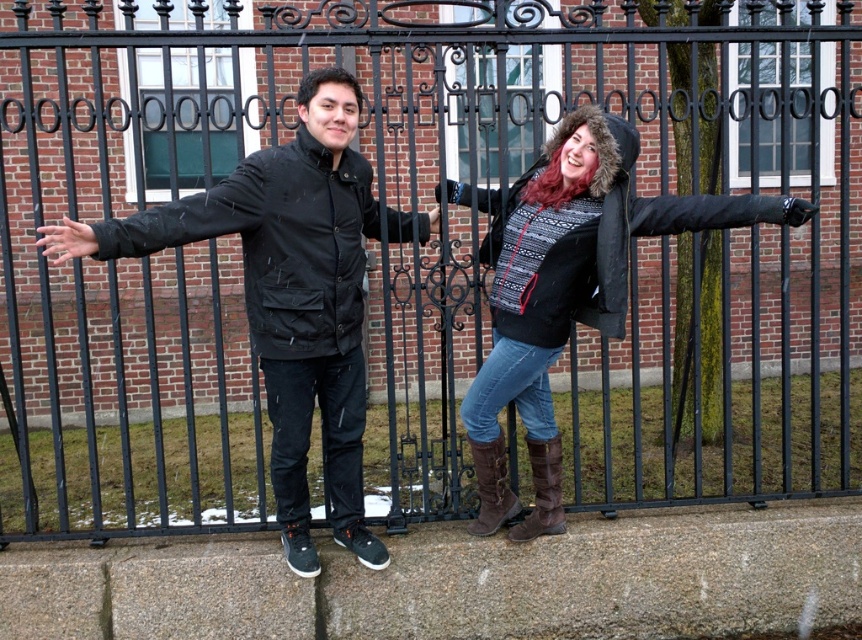
Is matte black jacket at left to the left of brown leather boot at lower center from the viewer's perspective?

Correct, you'll find matte black jacket at left to the left of brown leather boot at lower center.

Identify the location of matte black jacket at left. The width and height of the screenshot is (862, 640). (286, 296).

Locate an element on the screen. This screenshot has height=640, width=862. matte black jacket at left is located at coordinates (286, 296).

From the picture: Is matte black jacket at left wider than knit sweater at center?

No.

What do you see at coordinates (286, 296) in the screenshot? I see `matte black jacket at left` at bounding box center [286, 296].

Find the location of a particular element. The height and width of the screenshot is (640, 862). matte black jacket at left is located at coordinates pyautogui.click(x=286, y=296).

Does point (629, 168) come behind point (250, 216)?

Yes.

Is knit sweater at center positioned behind black matte jacket at left?

That is True.

Is point (765, 198) positioned in front of point (148, 225)?

No.

Where is `knit sweater at center`? The height and width of the screenshot is (640, 862). knit sweater at center is located at coordinates (576, 257).